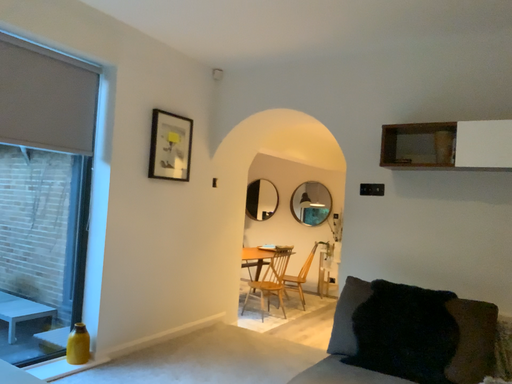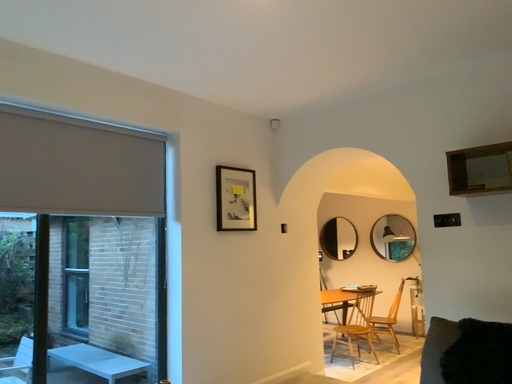
Question: How did the camera likely rotate when shooting the video?

Choices:
 (A) rotated right
 (B) rotated left

Answer: (B)